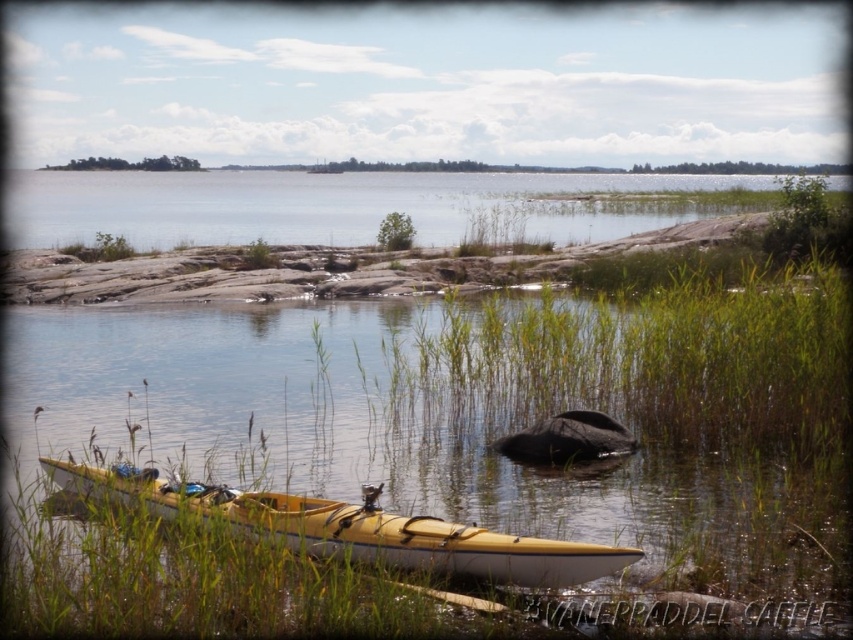
Question: Which point is farther to the camera?

Choices:
 (A) (495, 563)
 (B) (471, 179)
 (C) (801, 324)

Answer: (B)

Question: Can you confirm if clear water at center is positioned to the left of yellow matte kayak at lower left?

Choices:
 (A) yes
 (B) no

Answer: (A)

Question: Is clear water at center below yellow matte kayak at lower left?

Choices:
 (A) yes
 (B) no

Answer: (B)

Question: Which is farther from the yellow matte kayak at lower left?

Choices:
 (A) clear water at center
 (B) green grass at lower center

Answer: (A)

Question: Which object is positioned closest to the yellow matte kayak at lower left?

Choices:
 (A) clear water at center
 (B) green grass at lower center

Answer: (B)

Question: Is clear water at center below yellow matte kayak at lower left?

Choices:
 (A) no
 (B) yes

Answer: (A)